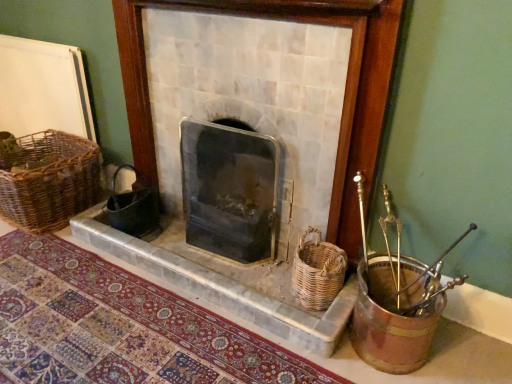
Question: From the image's perspective, is black glass wood burning stove at center below black wicker gift basket at center?

Choices:
 (A) no
 (B) yes

Answer: (A)

Question: Considering the relative positions of black glass wood burning stove at center and black wicker gift basket at center in the image provided, is black glass wood burning stove at center behind black wicker gift basket at center?

Choices:
 (A) no
 (B) yes

Answer: (A)

Question: Is black glass wood burning stove at center looking in the opposite direction of black wicker gift basket at center?

Choices:
 (A) yes
 (B) no

Answer: (B)

Question: Is black glass wood burning stove at center far from black wicker gift basket at center?

Choices:
 (A) yes
 (B) no

Answer: (B)

Question: Does black glass wood burning stove at center have a lesser height compared to black wicker gift basket at center?

Choices:
 (A) yes
 (B) no

Answer: (B)

Question: Is patterned carpet at lower left in front of or behind woven brown basket at left, the second basket from the front, in the image?

Choices:
 (A) front
 (B) behind

Answer: (A)

Question: From a real-world perspective, is patterned carpet at lower left positioned above or below woven brown basket at left, the second basket from the front?

Choices:
 (A) below
 (B) above

Answer: (A)

Question: Based on their sizes in the image, would you say patterned carpet at lower left is bigger or smaller than woven brown basket at left, which is the first basket in left-to-right order?

Choices:
 (A) small
 (B) big

Answer: (A)

Question: Is patterned carpet at lower left wider or thinner than woven brown basket at left, which appears as the 2th basket when viewed from the right?

Choices:
 (A) wide
 (B) thin

Answer: (A)

Question: Looking at the image, does black glass wood burning stove at center seem bigger or smaller compared to patterned carpet at lower left?

Choices:
 (A) big
 (B) small

Answer: (A)

Question: Is black glass wood burning stove at center taller or shorter than patterned carpet at lower left?

Choices:
 (A) tall
 (B) short

Answer: (A)

Question: Is black glass wood burning stove at center wider or thinner than patterned carpet at lower left?

Choices:
 (A) thin
 (B) wide

Answer: (A)

Question: Considering the positions of point (197, 158) and point (185, 322), is point (197, 158) closer or farther from the camera than point (185, 322)?

Choices:
 (A) closer
 (B) farther

Answer: (B)

Question: From a real-world perspective, is black glass wood burning stove at center above or below white marble fireplace at center?

Choices:
 (A) below
 (B) above

Answer: (A)

Question: Does point (248, 241) appear closer or farther from the camera than point (354, 99)?

Choices:
 (A) closer
 (B) farther

Answer: (B)